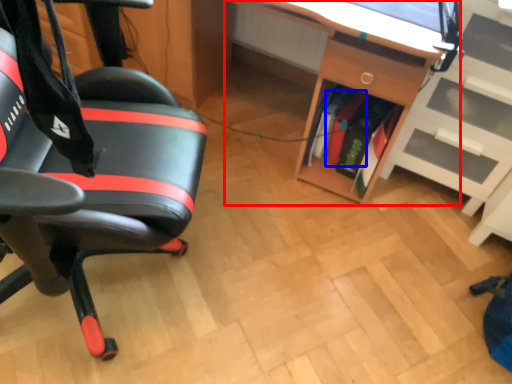
Question: Which object appears farthest to the camera in this image, desk (highlighted by a red box) or book (highlighted by a blue box)?

Choices:
 (A) desk
 (B) book

Answer: (B)